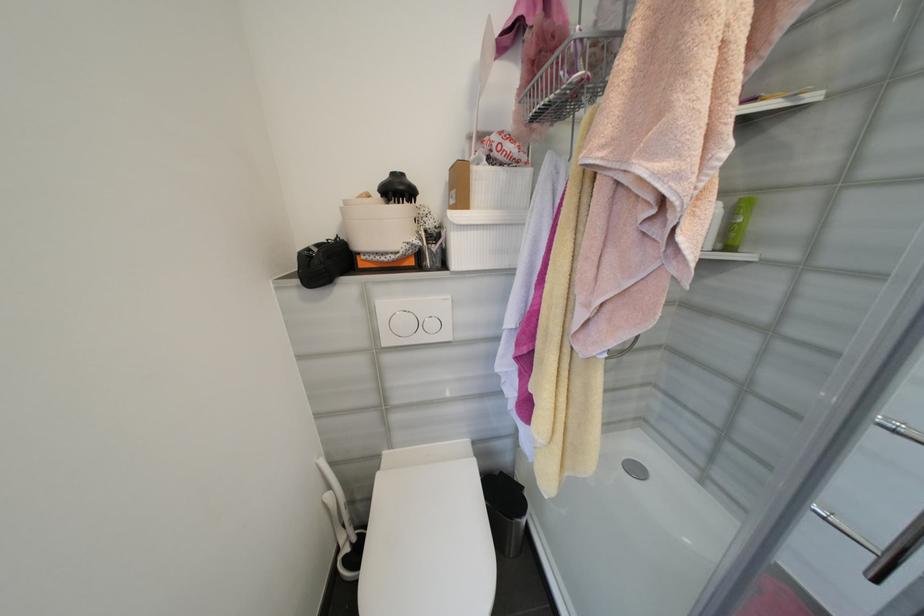
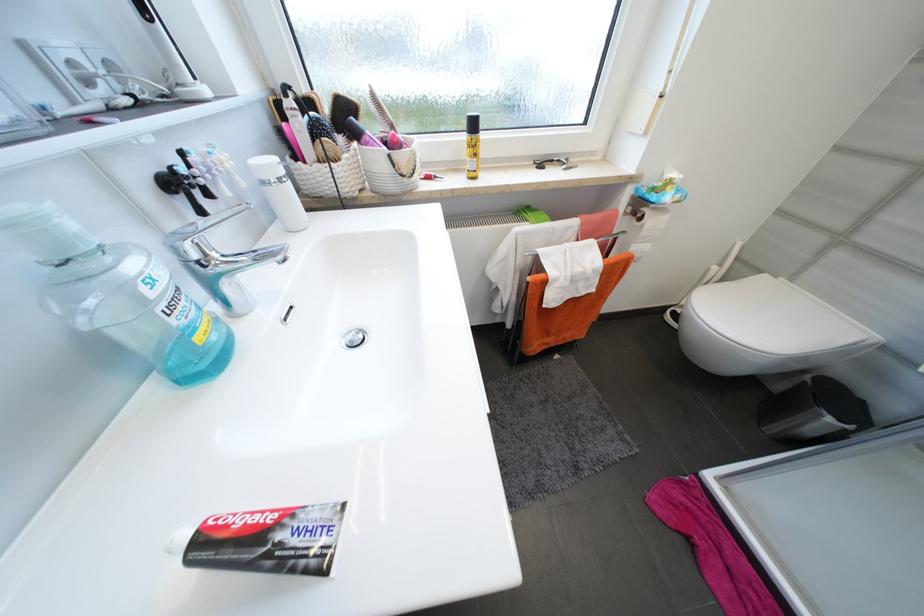
Where in the second image is the point corresponding to (530,522) from the first image?

(834, 421)